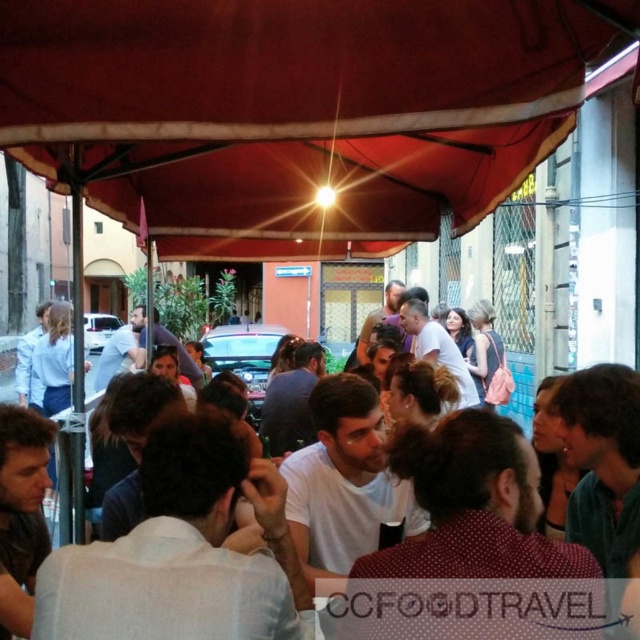
You are standing at the edge of the scene and want to walk towards the white cotton shirt at center. Which direction should you move relative to the red fabric canopy at center?

Since the red fabric canopy at center is to the left of the white cotton shirt at center, you should move to the right relative to the red fabric canopy at center to reach the white cotton shirt at center.

Looking at this image, you are at a social event under the red fabric canopy at center and wearing a white cotton shirt at center. If you want to take a photo of yourself under the canopy, will the entire canopy fit in the frame if your shirt is already centered?

A: The red fabric canopy at center is bigger than the white cotton shirt at center. Since the shirt is centered, the canopy, being larger, would extend beyond the frame unless the camera is zoomed out further.

You are a photographer trying to capture a photo of the white cotton shirt at center without the red fabric canopy at center appearing in the background. Is this possible given their positions?

The red fabric canopy at center is much taller than the white cotton shirt at center, so it is likely blocking the background. Therefore, it might not be possible to take a photo of the white cotton shirt at center without the red fabric canopy at center appearing in the background.